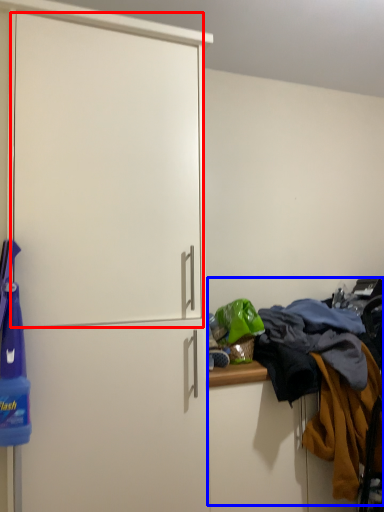
Question: Which object is further to the camera taking this photo, screen door (highlighted by a red box) or laundry (highlighted by a blue box)?

Choices:
 (A) screen door
 (B) laundry

Answer: (B)